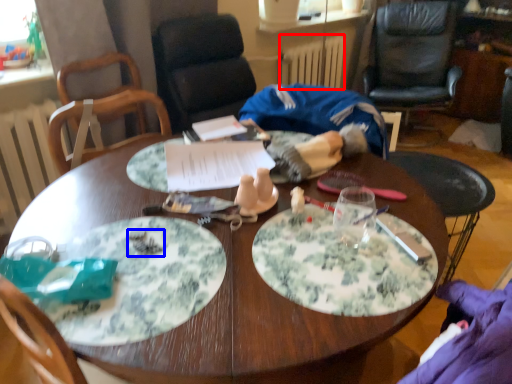
Question: Which point is further to the camera, radiator (highlighted by a red box) or food (highlighted by a blue box)?

Choices:
 (A) radiator
 (B) food

Answer: (A)